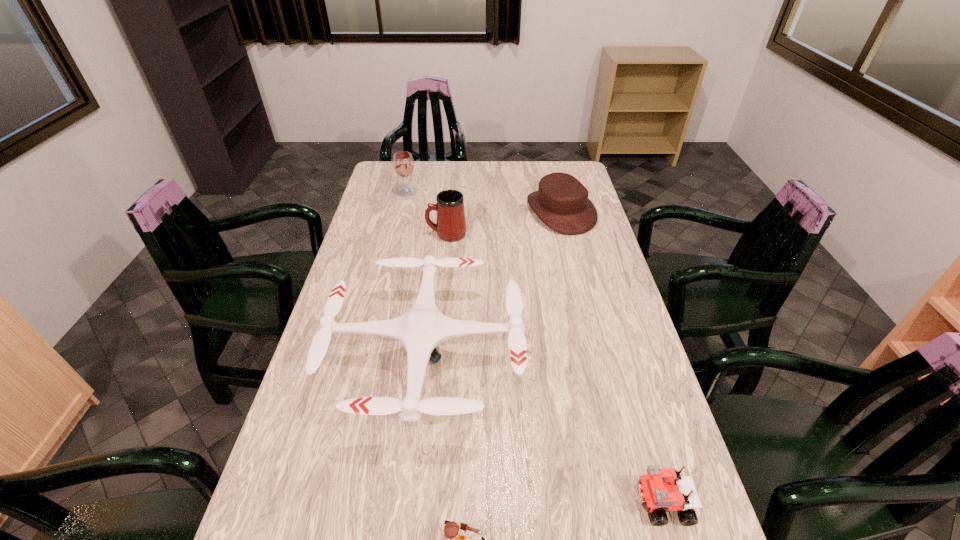
Find the location of `vacant position at the far edge of the desktop`. vacant position at the far edge of the desktop is located at coordinates (423, 166).

In the image, there is a desktop. Where is `free space at the left edge`? free space at the left edge is located at coordinates (263, 524).

The width and height of the screenshot is (960, 540). I want to click on vacant space at the right edge of the desktop, so click(x=595, y=242).

Locate an element on the screen. Image resolution: width=960 pixels, height=540 pixels. vacant region at the far left corner of the desktop is located at coordinates (410, 179).

The width and height of the screenshot is (960, 540). What are the coordinates of `free space between the right Lego and the wineglass` in the screenshot? It's located at (534, 348).

This screenshot has height=540, width=960. I want to click on unoccupied area between the wineglass and the hat, so click(x=484, y=201).

Identify the location of free space between the drone and the mug. Image resolution: width=960 pixels, height=540 pixels. (436, 293).

The image size is (960, 540). I want to click on vacant area between the third nearest object and the right Lego, so click(543, 428).

The height and width of the screenshot is (540, 960). Identify the location of vacant space that is in between the third nearest object and the mug. (436, 293).

Identify which object is located as the fourth nearest to the right Lego. Please provide its 2D coordinates. Your answer should be formatted as a tuple, i.e. [(x, y)], where the tuple contains the x and y coordinates of a point satisfying the conditions above.

[(450, 226)]